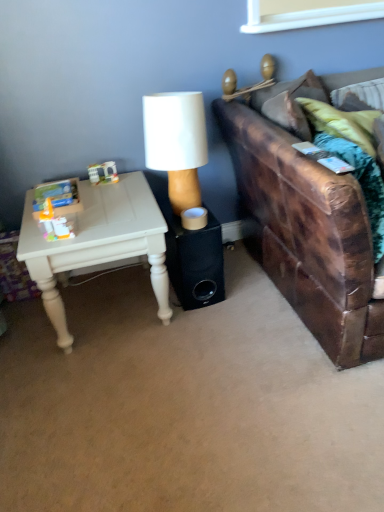
Where is `free space in front of white painted wood table at left`? The width and height of the screenshot is (384, 512). free space in front of white painted wood table at left is located at coordinates (107, 387).